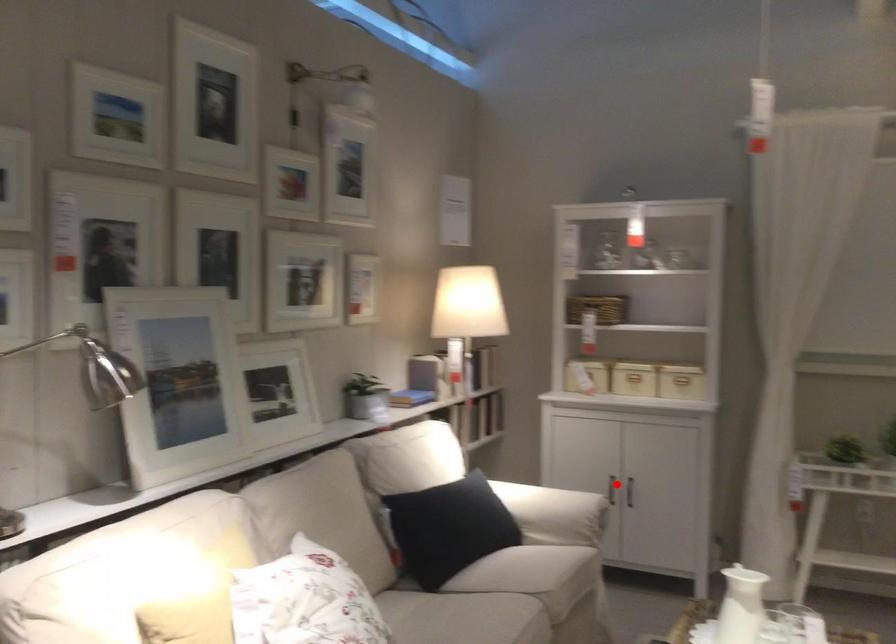
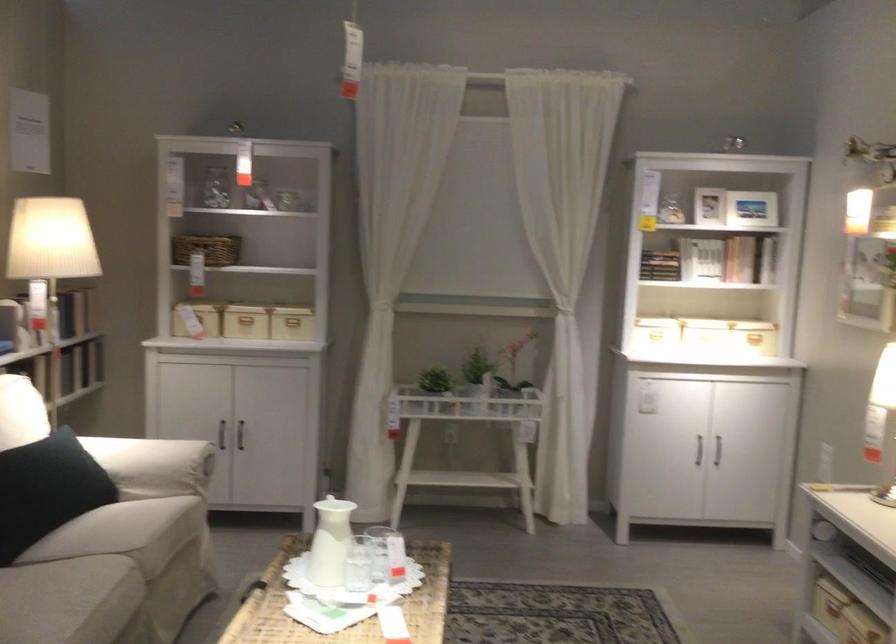
Find the pixel in the second image that matches the highlighted location in the first image.

(221, 433)